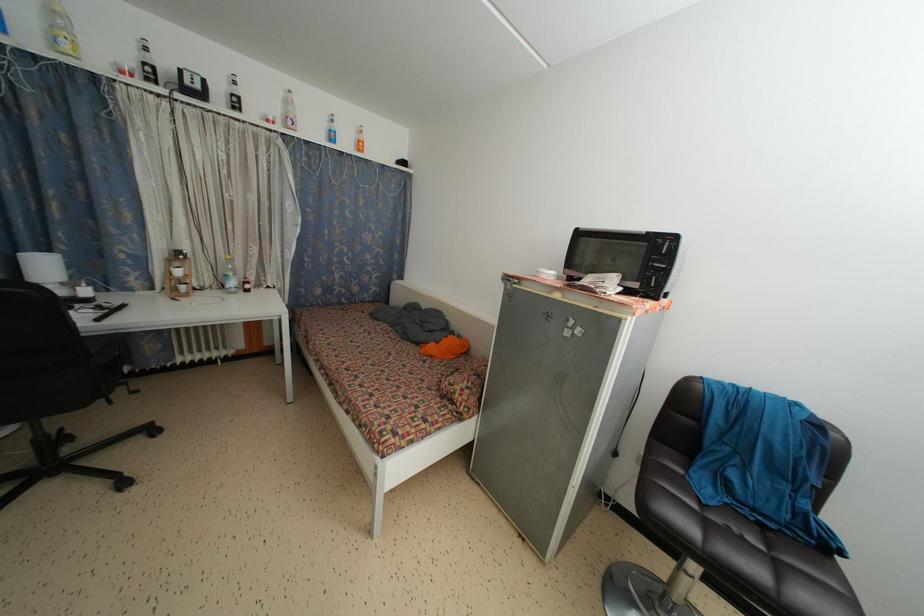
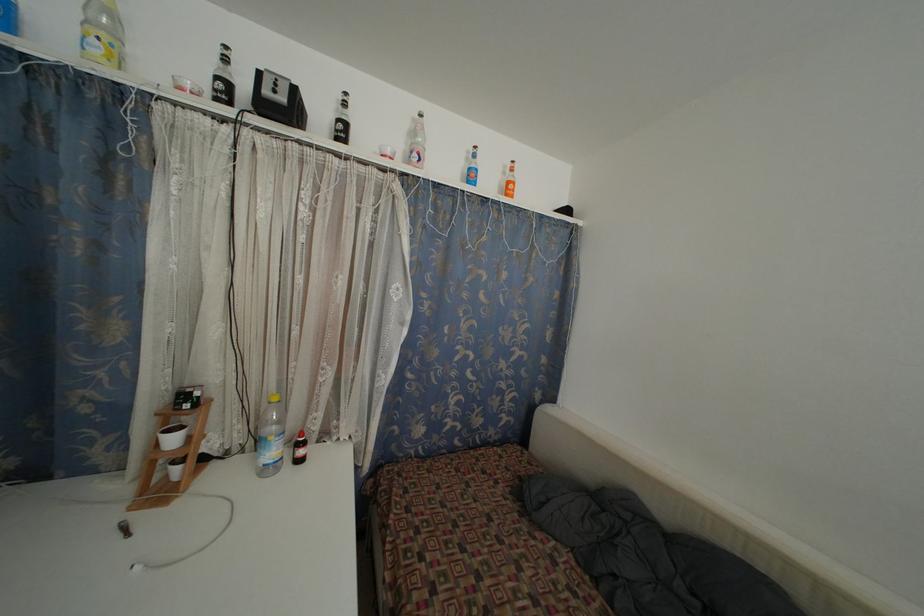
The point at (296,121) is marked in the first image. Where is the corresponding point in the second image?

(423, 154)